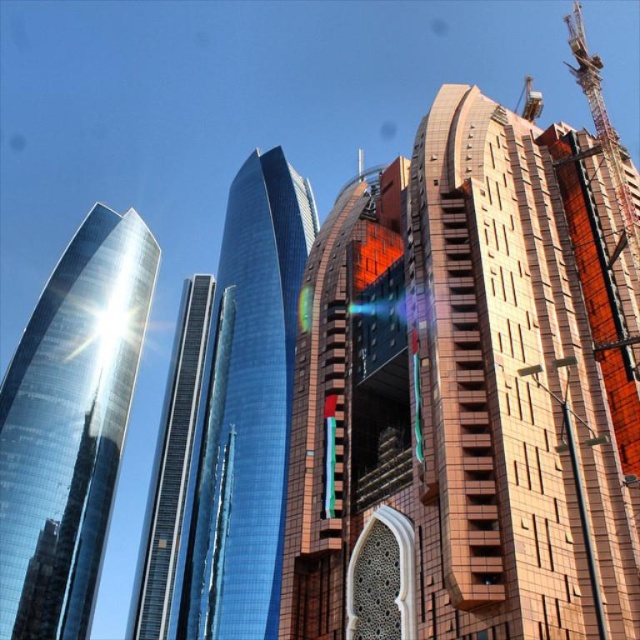
Question: Which object is farther from the camera taking this photo?

Choices:
 (A) glossy glass skyscraper at center
 (B) brown textured building at center
 (C) shiny glass skyscraper at center

Answer: (C)

Question: Is brown textured building at center bigger than glossy glass skyscraper at center?

Choices:
 (A) yes
 (B) no

Answer: (B)

Question: Which point appears closest to the camera in this image?

Choices:
 (A) (96, 312)
 (B) (308, 464)
 (C) (355, 339)
 (D) (186, 589)

Answer: (B)

Question: Is brown textured building at center wider than shiny metallic skyscraper at left?

Choices:
 (A) yes
 (B) no

Answer: (A)

Question: Which of the following is the closest to the observer?

Choices:
 (A) shiny metallic skyscraper at left
 (B) shiny glass skyscraper at center
 (C) glossy glass skyscraper at center
 (D) brown textured building at center

Answer: (D)

Question: Can you confirm if brown textured building at center is positioned to the left of orange brick building at center?

Choices:
 (A) no
 (B) yes

Answer: (A)